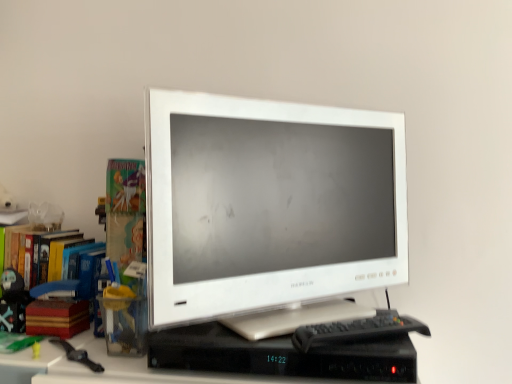
Locate an element on the screen. vacant region above black plastic computer desk at center (from a real-world perspective) is located at coordinates (291, 330).